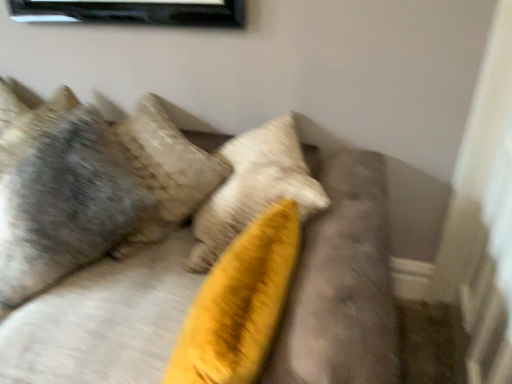
This screenshot has width=512, height=384. What do you see at coordinates (342, 285) in the screenshot?
I see `velvet yellow pillow at center` at bounding box center [342, 285].

The height and width of the screenshot is (384, 512). I want to click on velvet yellow pillow at center, so click(x=342, y=285).

What is the approximate height of textured gray pillow at upper left?

The height of textured gray pillow at upper left is 70.87 centimeters.

This screenshot has width=512, height=384. What do you see at coordinates (60, 192) in the screenshot?
I see `textured gray pillow at upper left` at bounding box center [60, 192].

Find the location of a particular element. The height and width of the screenshot is (384, 512). textured gray pillow at upper left is located at coordinates (60, 192).

You are a GUI agent. You are given a task and a screenshot of the screen. Output one action in this format:
    pyautogui.click(x=<x>, y=<y>)
    Task: Click on the velvet yellow pillow at center
    This screenshot has height=384, width=512.
    Given the screenshot: What is the action you would take?
    pyautogui.click(x=342, y=285)

Considering the relative positions of textured gray pillow at upper left and velvet yellow pillow at center in the image provided, is textured gray pillow at upper left to the left or to the right of velvet yellow pillow at center?

textured gray pillow at upper left is to the left of velvet yellow pillow at center.

In the scene shown: Is textured gray pillow at upper left closer to camera compared to velvet yellow pillow at center?

That is False.

Which is closer to the camera, [70,117] or [87,307]?

Point [70,117] appears to be farther away from the viewer than point [87,307].

From the image's perspective, is textured gray pillow at upper left located beneath velvet yellow pillow at center?

Actually, textured gray pillow at upper left appears above velvet yellow pillow at center in the image.

From a real-world perspective, is textured gray pillow at upper left positioned above or below velvet yellow pillow at center?

In terms of real-world spatial position, textured gray pillow at upper left is above velvet yellow pillow at center.

In terms of width, does textured gray pillow at upper left look wider or thinner when compared to velvet yellow pillow at center?

textured gray pillow at upper left is thinner than velvet yellow pillow at center.

Does textured gray pillow at upper left have a greater height compared to velvet yellow pillow at center?

Yes.

Can you confirm if textured gray pillow at upper left is bigger than velvet yellow pillow at center?

No.

Which is correct: textured gray pillow at upper left is inside velvet yellow pillow at center, or outside of it?

textured gray pillow at upper left fits inside velvet yellow pillow at center.

Is the surface of textured gray pillow at upper left in direct contact with velvet yellow pillow at center?

No, textured gray pillow at upper left is not touching velvet yellow pillow at center.

Is textured gray pillow at upper left facing away from velvet yellow pillow at center?

Yes, textured gray pillow at upper left is facing away from velvet yellow pillow at center.

Consider the image. Can you tell me how much textured gray pillow at upper left and velvet yellow pillow at center differ in facing direction?

There is a 36.3-degree angle between the facing directions of textured gray pillow at upper left and velvet yellow pillow at center.

Where is `pillow lying behind the velvet yellow pillow at center`? Image resolution: width=512 pixels, height=384 pixels. pillow lying behind the velvet yellow pillow at center is located at coordinates (60, 192).

Considering the relative positions of velvet yellow pillow at center and textured gray pillow at upper left in the image provided, is velvet yellow pillow at center to the left of textured gray pillow at upper left from the viewer's perspective?

No.

Is the position of velvet yellow pillow at center more distant than that of textured gray pillow at upper left?

No, it is not.

Is point (357, 192) positioned after point (104, 140)?

No, (357, 192) is closer to viewer.

From the image's perspective, would you say velvet yellow pillow at center is shown under textured gray pillow at upper left?

Indeed, from the image's perspective, velvet yellow pillow at center is shown beneath textured gray pillow at upper left.

From a real-world perspective, who is located higher, velvet yellow pillow at center or textured gray pillow at upper left?

From a 3D spatial view, textured gray pillow at upper left is above.

Can you confirm if velvet yellow pillow at center is thinner than textured gray pillow at upper left?

No, velvet yellow pillow at center is not thinner than textured gray pillow at upper left.

In terms of height, does velvet yellow pillow at center look taller or shorter compared to textured gray pillow at upper left?

In the image, velvet yellow pillow at center appears to be shorter than textured gray pillow at upper left.

Considering the sizes of objects velvet yellow pillow at center and textured gray pillow at upper left in the image provided, who is bigger, velvet yellow pillow at center or textured gray pillow at upper left?

velvet yellow pillow at center.

Is textured gray pillow at upper left completely or partially inside velvet yellow pillow at center?

Yes, textured gray pillow at upper left is surrounded by velvet yellow pillow at center.

Are velvet yellow pillow at center and textured gray pillow at upper left located far from each other?

That's not correct — velvet yellow pillow at center is a little close to textured gray pillow at upper left.

Is velvet yellow pillow at center looking in the opposite direction of textured gray pillow at upper left?

Correct, velvet yellow pillow at center is looking away from textured gray pillow at upper left.

Identify the location of pillow positioned vertically above the velvet yellow pillow at center (from a real-world perspective). (60, 192).

The width and height of the screenshot is (512, 384). In the image, there is a velvet yellow pillow at center. What are the coordinates of `pillow above it (from the image's perspective)` in the screenshot? It's located at (60, 192).

The width and height of the screenshot is (512, 384). I want to click on furniture lying below the textured gray pillow at upper left (from the image's perspective), so click(342, 285).